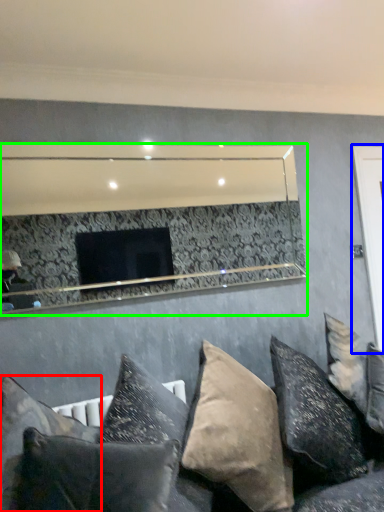
Question: Which object is the closest to the pillow (highlighted by a red box)? Choose among these: glass door (highlighted by a blue box) or mirror (highlighted by a green box).

Choices:
 (A) glass door
 (B) mirror

Answer: (A)